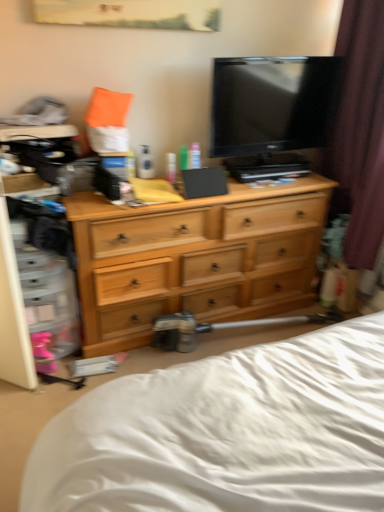
Question: Is the depth of green plastic bottle at center, the 2th toiletry from the right, greater than that of light wood dresser at center?

Choices:
 (A) yes
 (B) no

Answer: (A)

Question: Is green plastic bottle at center, the first toiletry positioned from the left, bigger than light wood dresser at center?

Choices:
 (A) no
 (B) yes

Answer: (A)

Question: Does green plastic bottle at center, the 2th toiletry from the right, have a greater height compared to light wood dresser at center?

Choices:
 (A) yes
 (B) no

Answer: (B)

Question: Is light wood dresser at center located within green plastic bottle at center, the first toiletry positioned from the left?

Choices:
 (A) no
 (B) yes

Answer: (A)

Question: From the image's perspective, does green plastic bottle at center, the first toiletry positioned from the left, appear lower than light wood dresser at center?

Choices:
 (A) yes
 (B) no

Answer: (B)

Question: Considering the relative sizes of green plastic bottle at center, the first toiletry positioned from the left, and light wood dresser at center in the image provided, is green plastic bottle at center, the first toiletry positioned from the left, thinner than light wood dresser at center?

Choices:
 (A) no
 (B) yes

Answer: (B)

Question: Does translucent plastic tube at center, placed as the first toiletry when sorted from right to left, have a larger size compared to white soft bed at lower center?

Choices:
 (A) yes
 (B) no

Answer: (B)

Question: From a real-world perspective, is translucent plastic tube at center, the second toiletry viewed from the left, beneath white soft bed at lower center?

Choices:
 (A) no
 (B) yes

Answer: (A)

Question: Is translucent plastic tube at center, placed as the first toiletry when sorted from right to left, located outside white soft bed at lower center?

Choices:
 (A) no
 (B) yes

Answer: (B)

Question: Can you confirm if translucent plastic tube at center, placed as the first toiletry when sorted from right to left, is smaller than white soft bed at lower center?

Choices:
 (A) no
 (B) yes

Answer: (B)

Question: From a real-world perspective, is translucent plastic tube at center, the second toiletry viewed from the left, positioned over white soft bed at lower center based on gravity?

Choices:
 (A) yes
 (B) no

Answer: (A)

Question: Considering the relative positions of translucent plastic tube at center, the second toiletry viewed from the left, and white soft bed at lower center in the image provided, is translucent plastic tube at center, the second toiletry viewed from the left, in front of white soft bed at lower center?

Choices:
 (A) no
 (B) yes

Answer: (A)

Question: From a real-world perspective, is light wood dresser at center located higher than brown velvet curtain at right?

Choices:
 (A) no
 (B) yes

Answer: (A)